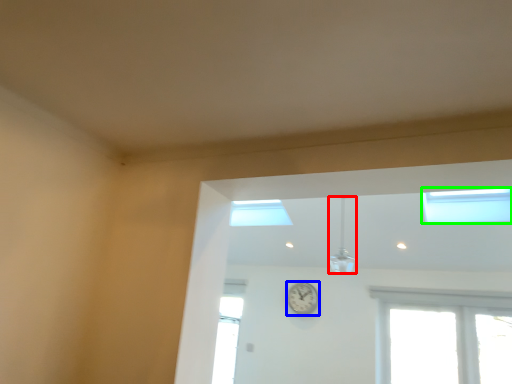
Question: Based on their relative distances, which object is farther from light fixture (highlighted by a red box)? Choose from clock (highlighted by a blue box) and window (highlighted by a green box).

Choices:
 (A) clock
 (B) window

Answer: (B)